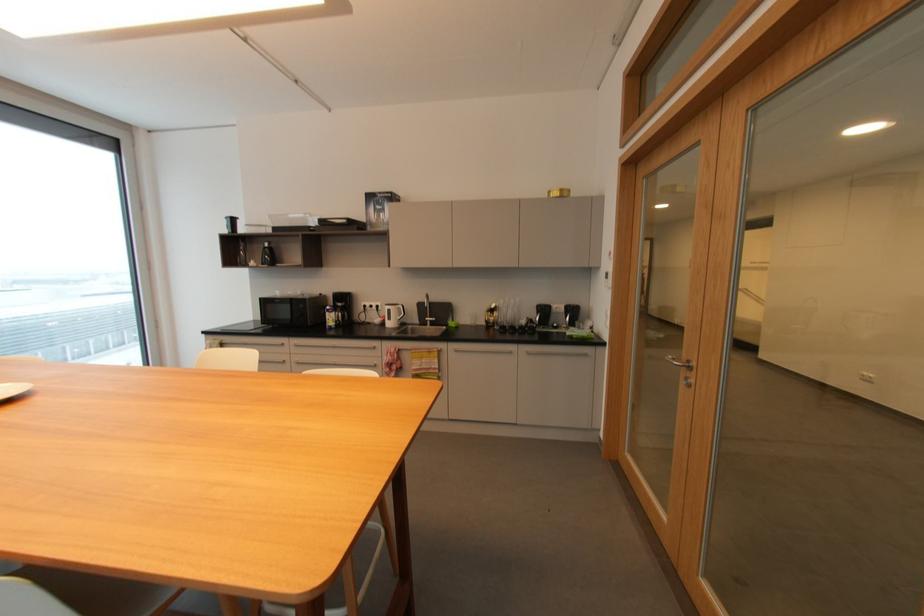
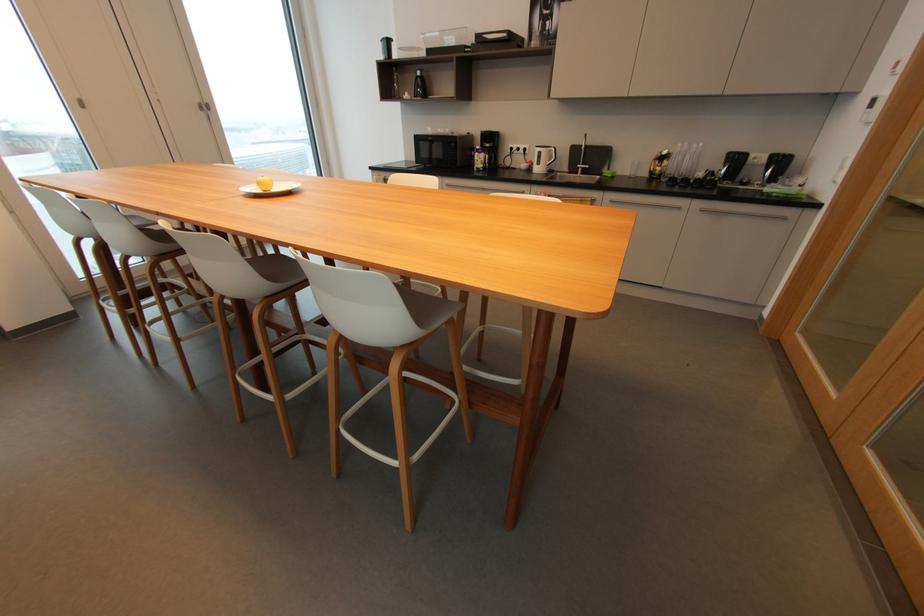
The point at (507, 325) is marked in the first image. Where is the corresponding point in the second image?

(678, 177)